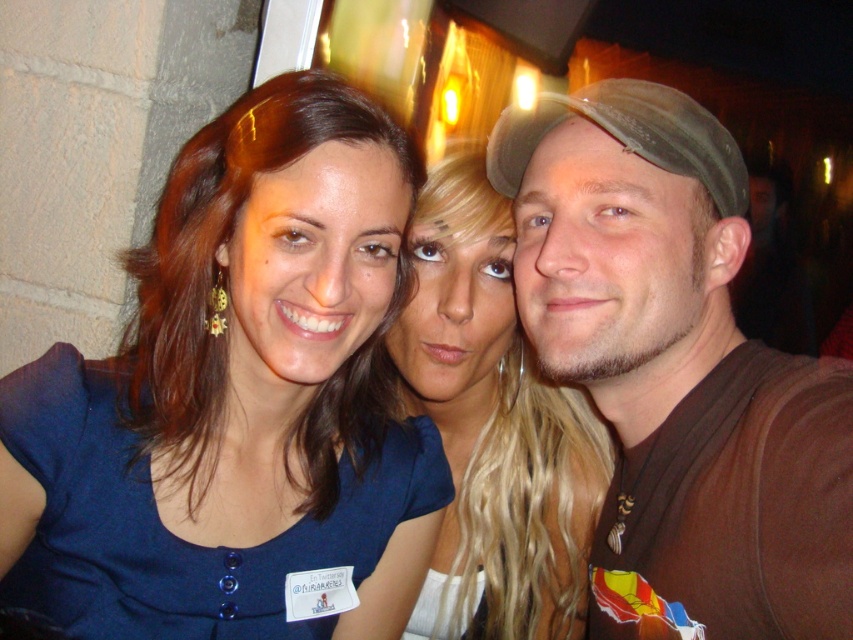
You are a photographer trying to adjust the lighting for a group photo. You notice the brown fabric shirt at center and the green fabric baseball cap at right. Which object is closer to the camera? Please explain based on their positions.

The brown fabric shirt at center is closer to the camera than the green fabric baseball cap at right because it is only 5.05 inches away from it.

Based on the photo, you are standing in front of the photograph and notice a point marked at coordinates (236, 401). Based on the scene description, what object does this point correspond to?

The point at (236, 401) corresponds to the blue fabric dress at upper left as described in the scene.